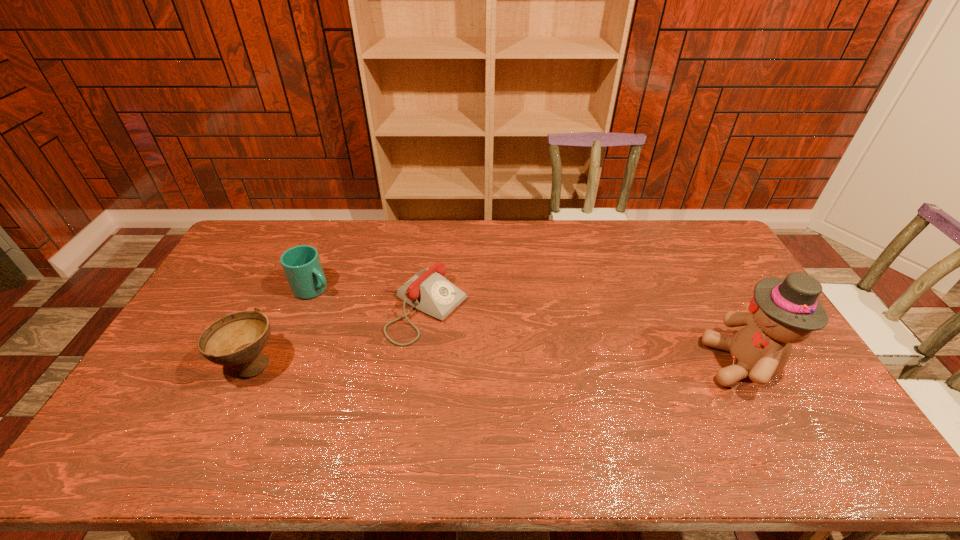
I want to click on vacant point located between the telephone and the soup bowl, so click(x=337, y=336).

Locate an element on the screen. This screenshot has width=960, height=540. free spot between the second object from right to left and the soup bowl is located at coordinates (337, 336).

Where is `free space between the second object from right to left and the tallest object`? Image resolution: width=960 pixels, height=540 pixels. free space between the second object from right to left and the tallest object is located at coordinates (584, 336).

Find the location of a particular element. The image size is (960, 540). free spot between the tallest object and the shortest object is located at coordinates (584, 336).

Select which object appears as the closest to the telephone. Please provide its 2D coordinates. Your answer should be formatted as a tuple, i.e. [(x, y)], where the tuple contains the x and y coordinates of a point satisfying the conditions above.

[(301, 264)]

Select which object appears as the second closest to the shortest object. Please provide its 2D coordinates. Your answer should be formatted as a tuple, i.e. [(x, y)], where the tuple contains the x and y coordinates of a point satisfying the conditions above.

[(237, 339)]

Identify the location of vacant space that satisfies the following two spatial constraints: 1. on the front side of the rightmost object; 2. on the front-facing side of the second object from right to left. (417, 363).

Where is `free space that satisfies the following two spatial constraints: 1. on the front side of the cup; 2. on the left side of the second object from right to left`? The image size is (960, 540). free space that satisfies the following two spatial constraints: 1. on the front side of the cup; 2. on the left side of the second object from right to left is located at coordinates (305, 309).

The height and width of the screenshot is (540, 960). I want to click on vacant position in the image that satisfies the following two spatial constraints: 1. on the back side of the cup; 2. on the right side of the soup bowl, so click(287, 288).